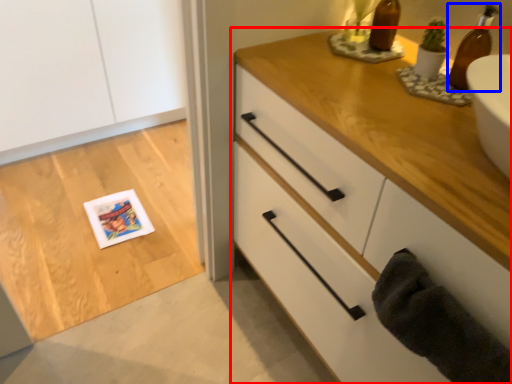
Question: Which object appears closest to the camera in this image, chest of drawers (highlighted by a red box) or beer bottle (highlighted by a blue box)?

Choices:
 (A) chest of drawers
 (B) beer bottle

Answer: (A)